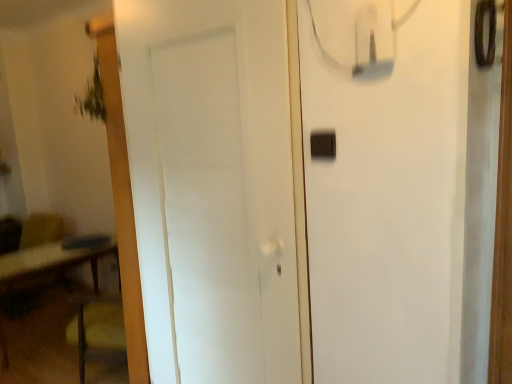
Question: Is white matte door at center bigger than black plastic light switch at upper right?

Choices:
 (A) yes
 (B) no

Answer: (A)

Question: Does white matte door at center lie behind black plastic light switch at upper right?

Choices:
 (A) no
 (B) yes

Answer: (A)

Question: Is white matte door at center at the right side of black plastic light switch at upper right?

Choices:
 (A) no
 (B) yes

Answer: (A)

Question: Is white matte door at center outside of black plastic light switch at upper right?

Choices:
 (A) yes
 (B) no

Answer: (A)

Question: Can you confirm if white matte door at center is thinner than black plastic light switch at upper right?

Choices:
 (A) yes
 (B) no

Answer: (B)

Question: Does white matte door at center touch black plastic light switch at upper right?

Choices:
 (A) yes
 (B) no

Answer: (B)

Question: From the image's perspective, does black plastic light switch at upper right appear higher than white matte door at center?

Choices:
 (A) no
 (B) yes

Answer: (B)

Question: Is black plastic light switch at upper right taller than white matte door at center?

Choices:
 (A) no
 (B) yes

Answer: (A)

Question: Is black plastic light switch at upper right shorter than white matte door at center?

Choices:
 (A) yes
 (B) no

Answer: (A)

Question: Is black plastic light switch at upper right to the right of white matte door at center from the viewer's perspective?

Choices:
 (A) no
 (B) yes

Answer: (B)

Question: Does black plastic light switch at upper right turn towards white matte door at center?

Choices:
 (A) yes
 (B) no

Answer: (B)

Question: Is black plastic light switch at upper right far from white matte door at center?

Choices:
 (A) no
 (B) yes

Answer: (A)

Question: In terms of size, does white matte door at center appear bigger or smaller than black plastic light switch at upper right?

Choices:
 (A) big
 (B) small

Answer: (A)